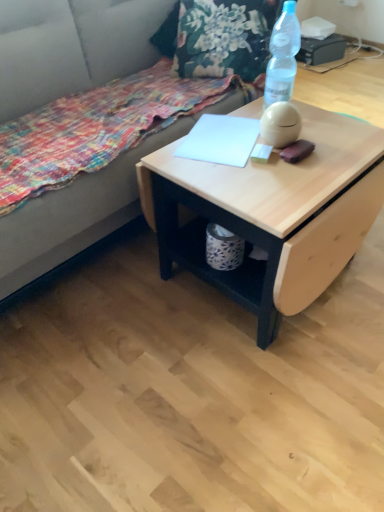
This screenshot has width=384, height=512. Find the location of `vacant space situated on the left part of natural wood desk at center`. vacant space situated on the left part of natural wood desk at center is located at coordinates (109, 308).